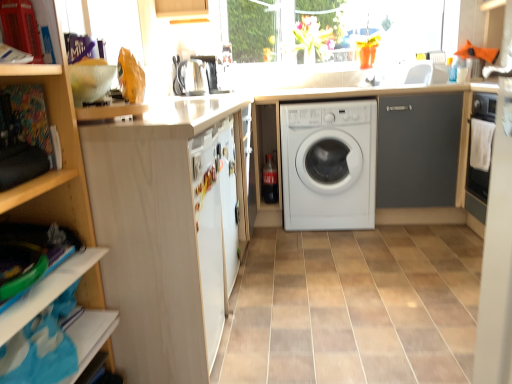
Question: Does white matte washing machine at center have a greater width compared to satin silver coffee machine at upper center?

Choices:
 (A) yes
 (B) no

Answer: (A)

Question: Can you confirm if white matte washing machine at center is thinner than satin silver coffee machine at upper center?

Choices:
 (A) yes
 (B) no

Answer: (B)

Question: From the image's perspective, is white matte washing machine at center beneath satin silver coffee machine at upper center?

Choices:
 (A) yes
 (B) no

Answer: (A)

Question: Can you confirm if white matte washing machine at center is smaller than satin silver coffee machine at upper center?

Choices:
 (A) no
 (B) yes

Answer: (A)

Question: Can you confirm if white matte washing machine at center is shorter than satin silver coffee machine at upper center?

Choices:
 (A) no
 (B) yes

Answer: (A)

Question: Is white matte washing machine at center at the left side of satin silver coffee machine at upper center?

Choices:
 (A) no
 (B) yes

Answer: (A)

Question: Is satin silver kettle at upper center closer to camera compared to white matte washing machine at center?

Choices:
 (A) no
 (B) yes

Answer: (A)

Question: Is satin silver kettle at upper center far from white matte washing machine at center?

Choices:
 (A) yes
 (B) no

Answer: (A)

Question: Can you confirm if satin silver kettle at upper center is positioned to the right of white matte washing machine at center?

Choices:
 (A) no
 (B) yes

Answer: (A)

Question: Is satin silver kettle at upper center oriented away from white matte washing machine at center?

Choices:
 (A) no
 (B) yes

Answer: (A)

Question: Considering the relative sizes of satin silver kettle at upper center and white matte washing machine at center in the image provided, is satin silver kettle at upper center shorter than white matte washing machine at center?

Choices:
 (A) no
 (B) yes

Answer: (B)

Question: Is satin silver kettle at upper center facing towards white matte washing machine at center?

Choices:
 (A) no
 (B) yes

Answer: (A)

Question: Can you confirm if white glossy sink at upper right is smaller than white matte refrigerator at center?

Choices:
 (A) yes
 (B) no

Answer: (B)